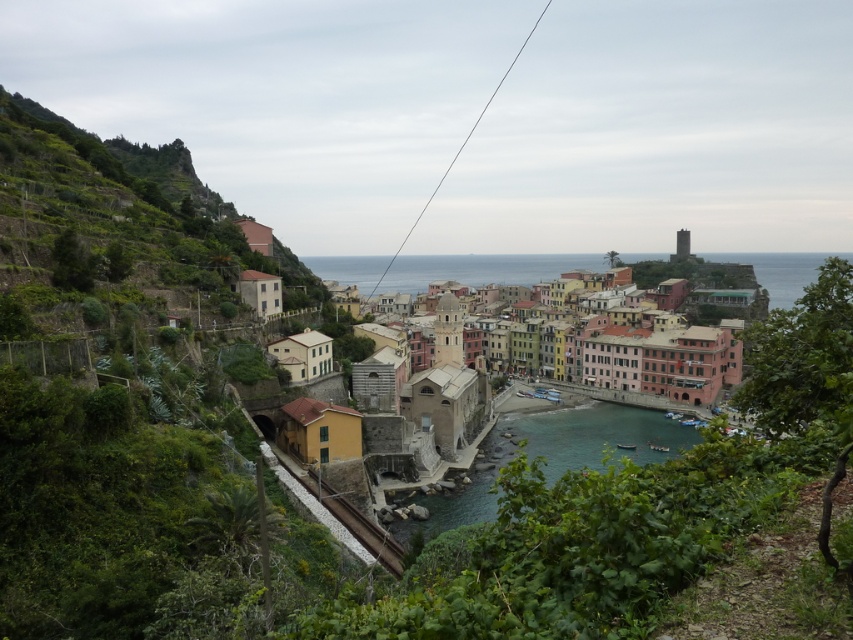
You are a tourist in the coastal town and want to take a photo that includes both the clear blue water at center and the multicolored painted buildings at center. Based on their sizes in the image, which one should you focus on to ensure both are visible in the frame?

The clear blue water at center occupies less space than the multicolored painted buildings at center, so you should focus on the multicolored painted buildings at center to ensure both fit in the frame.

You are standing at the starting point of the coastal town trail and see two points marked on the map. The first point is at coordinate point (688,444) and the second is at point (703,401). Which point would you reach first while walking along the trail?

Point (688,444) is in front of point (703,401), so you would reach point (688,444) first while walking along the trail.

You are standing at the edge of the dense vegetation in the foreground of the coastal town scene. You see the clear blue water at center and the multicolored painted buildings at center. Which of these two objects appears taller from your vantage point?

The multicolored painted buildings at center appear taller than the clear blue water at center from your vantage point.